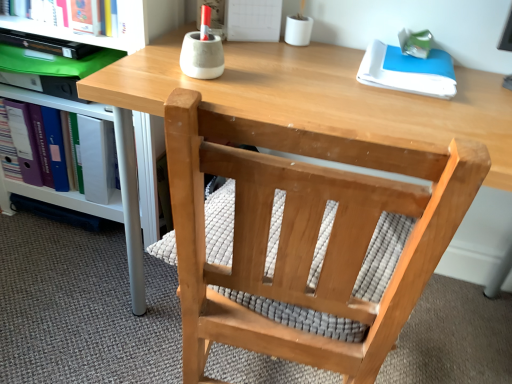
This screenshot has width=512, height=384. In order to click on white glossy shelf at lower left in this screenshot , I will do `click(139, 189)`.

Identify the location of natural wood chair at center. (306, 251).

Looking at this image, from the image's perspective, between white glossy shelf at lower left and purple ring-binder at left, who is located below?

From the image's view, purple ring-binder at left is below.

Choose the correct answer: Is white glossy shelf at lower left inside purple ring-binder at left or outside it?

white glossy shelf at lower left is outside purple ring-binder at left.

Is point (137, 239) closer to viewer compared to point (12, 98)?

That is True.

Between white glossy shelf at lower left and purple ring-binder at left, which one has larger width?

With larger width is white glossy shelf at lower left.

Is natural wood chair at center facing away from white paper at upper right?

natural wood chair at center is not turned away from white paper at upper right.

Who is taller, natural wood chair at center or white paper at upper right?

natural wood chair at center is taller.

Is natural wood chair at center to the right of white paper at upper right from the viewer's perspective?

In fact, natural wood chair at center is to the left of white paper at upper right.

From the image's perspective, is white paper at upper right above or below purple ring-binder at left?

white paper at upper right is above purple ring-binder at left.

Can you tell me how much white paper at upper right and purple ring-binder at left differ in facing direction?

0.622 degrees separate the facing orientations of white paper at upper right and purple ring-binder at left.

Based on the photo, could purple ring-binder at left be considered to be inside white paper at upper right?

No, purple ring-binder at left is located outside of white paper at upper right.

Consider the image. Is white paper at upper right aimed at purple ring-binder at left?

No, white paper at upper right is not oriented towards purple ring-binder at left.

From the image's perspective, does white paper at upper right appear lower than natural wood chair at center?

Incorrect, from the image's perspective, white paper at upper right is higher than natural wood chair at center.

In the scene shown: Does white paper at upper right have a larger size compared to natural wood chair at center?

No, white paper at upper right is not bigger than natural wood chair at center.

Can you confirm if white paper at upper right is wider than natural wood chair at center?

No, white paper at upper right is not wider than natural wood chair at center.

Is white paper at upper right positioned in front of natural wood chair at center?

No, white paper at upper right is further to the viewer.

Is white glossy shelf at lower left facing towards white paper at upper right?

No.

Considering the sizes of objects white glossy shelf at lower left and white paper at upper right in the image provided, who is shorter, white glossy shelf at lower left or white paper at upper right?

white paper at upper right is shorter.

Locate an element on the screen. The width and height of the screenshot is (512, 384). paperback book above the white glossy shelf at lower left (from a real-world perspective) is located at coordinates (408, 71).

From a real-world perspective, who is located lower, purple ring-binder at left or white paper at upper right?

In real-world perspective, purple ring-binder at left is lower.

Are purple ring-binder at left and white paper at upper right making contact?

No, purple ring-binder at left is not with white paper at upper right.

From the image's perspective, between natural wood chair at center and purple ring-binder at left, who is located below?

natural wood chair at center is shown below in the image.

Based on the photo, considering the sizes of natural wood chair at center and purple ring-binder at left in the image, is natural wood chair at center taller or shorter than purple ring-binder at left?

In the image, natural wood chair at center appears to be shorter than purple ring-binder at left.

Which is correct: natural wood chair at center is inside purple ring-binder at left, or outside of it?

natural wood chair at center exists outside the volume of purple ring-binder at left.

Based on the photo, does natural wood chair at center come in front of purple ring-binder at left?

Yes, natural wood chair at center is closer to the camera.

Where is `book directly beneath the white glossy shelf at lower left (from a real-world perspective)`? book directly beneath the white glossy shelf at lower left (from a real-world perspective) is located at coordinates (67, 121).

Where is `paperback book lying on the right of natural wood chair at center`? This screenshot has height=384, width=512. paperback book lying on the right of natural wood chair at center is located at coordinates (408, 71).

From the image, which object appears to be farther from white paper at upper right, purple ring-binder at left or white glossy shelf at lower left?

purple ring-binder at left is positioned further to the anchor white paper at upper right.

Looking at this image, based on their spatial positions, is white paper at upper right or white glossy shelf at lower left closer to natural wood chair at center?

white glossy shelf at lower left is closer to natural wood chair at center.

Which object lies further to the anchor point white paper at upper right, natural wood chair at center or purple ring-binder at left?

purple ring-binder at left.

Estimate the real-world distances between objects in this image. Which object is further from purple ring-binder at left, white paper at upper right or natural wood chair at center?

white paper at upper right is positioned further to the anchor purple ring-binder at left.

When comparing their distances from white paper at upper right, does white glossy shelf at lower left or purple ring-binder at left seem further?

purple ring-binder at left.

Estimate the real-world distances between objects in this image. Which object is closer to white paper at upper right, white glossy shelf at lower left or natural wood chair at center?

Among the two, natural wood chair at center is located nearer to white paper at upper right.

Looking at the image, which one is located closer to purple ring-binder at left, natural wood chair at center or white glossy shelf at lower left?

white glossy shelf at lower left.

Which object lies further to the anchor point white glossy shelf at lower left, natural wood chair at center or purple ring-binder at left?

natural wood chair at center is further to white glossy shelf at lower left.

Locate an element on the screen. The height and width of the screenshot is (384, 512). chair located between white glossy shelf at lower left and white paper at upper right in the left-right direction is located at coordinates (306, 251).

Where is `shelf located between purple ring-binder at left and white paper at upper right in the left-right direction`? The height and width of the screenshot is (384, 512). shelf located between purple ring-binder at left and white paper at upper right in the left-right direction is located at coordinates (139, 189).

The width and height of the screenshot is (512, 384). What are the coordinates of `shelf between purple ring-binder at left and natural wood chair at center from left to right` in the screenshot? It's located at (139, 189).

Where is `chair located between purple ring-binder at left and white paper at upper right in the left-right direction`? This screenshot has height=384, width=512. chair located between purple ring-binder at left and white paper at upper right in the left-right direction is located at coordinates click(306, 251).